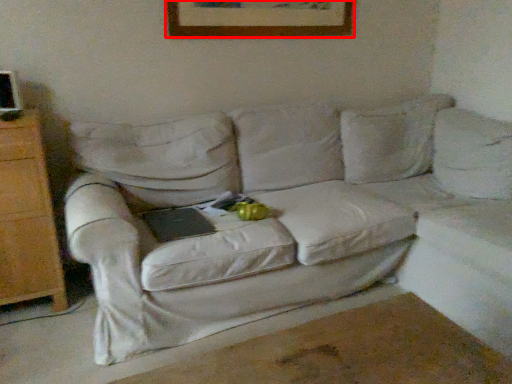
Question: Observing the image, what is the correct spatial positioning of picture frame (annotated by the red box) in reference to studio couch?

Choices:
 (A) right
 (B) left

Answer: (B)